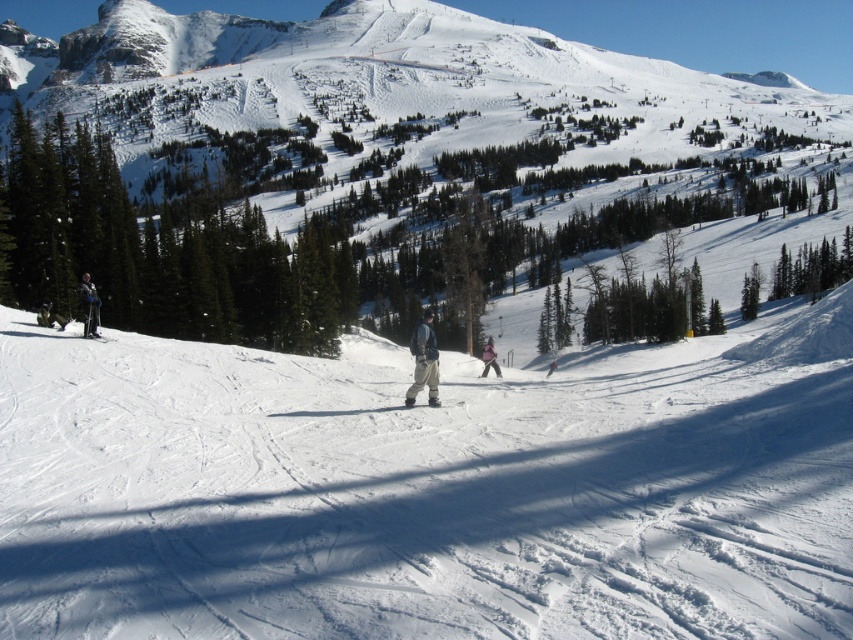
You are a photographer aiming to capture a clear photo of both the matte black skier at left and the matte black ski at left. Given their widths, which object should you focus on first to ensure it fits entirely within the frame?

The matte black skier at left is wider than the matte black ski at left. Therefore, focusing on the matte black skier at left first will ensure the entire skier fits, and the ski will naturally be within the frame since it is narrower.

You are a photographer standing at the center of the ski resort slope. You want to take a photo that includes both the point at coordinates point [434,403] and the point at coordinates point [434,403]. Which point should you focus on first to ensure both are in the frame?

You should focus on point [434,403] first because it is in front of point [434,403], so capturing it first ensures both points are within the frame.

You are a photographer planning to take a photo of the gray fabric jacket at center and the matte black ski at center. The camera lens has a maximum width capacity of 1.2 meters. Can both objects fit within the camera frame without any cropping?

The gray fabric jacket at center might be wider than matte black ski at center, so it is uncertain if both objects can fit within the camera frame without cropping. Check the actual width of the jacket to confirm.